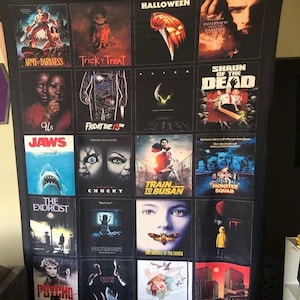
Locate an element on the screen. Image resolution: width=300 pixels, height=300 pixels. silence of the lambs poster is located at coordinates (164, 218).